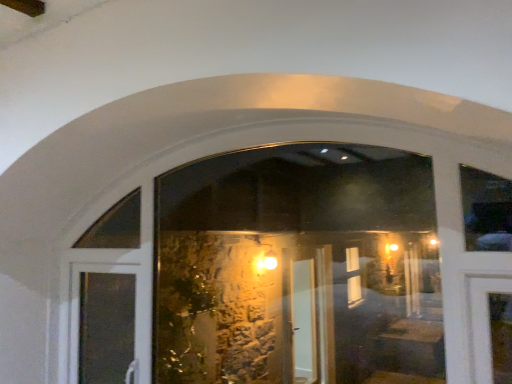
The image size is (512, 384). Find the location of `transparent glass door at center`. transparent glass door at center is located at coordinates (298, 268).

What is the approximate height of transparent glass door at center?

transparent glass door at center is 91.74 centimeters tall.

What do you see at coordinates (298, 268) in the screenshot? I see `transparent glass door at center` at bounding box center [298, 268].

Where is `matte glass door at lower left`? Image resolution: width=512 pixels, height=384 pixels. matte glass door at lower left is located at coordinates (104, 325).

The width and height of the screenshot is (512, 384). Describe the element at coordinates (104, 325) in the screenshot. I see `matte glass door at lower left` at that location.

I want to click on transparent glass door at center, so click(x=298, y=268).

Is matte glass door at lower left to the right of transparent glass door at center from the viewer's perspective?

Incorrect, matte glass door at lower left is not on the right side of transparent glass door at center.

Does matte glass door at lower left come behind transparent glass door at center?

Yes, it is behind transparent glass door at center.

Which is in front, point (117, 275) or point (411, 310)?

The point (117, 275) is more forward.

From the image's perspective, does matte glass door at lower left appear lower than transparent glass door at center?

Indeed, from the image's perspective, matte glass door at lower left is shown beneath transparent glass door at center.

From a real-world perspective, is matte glass door at lower left physically located above or below transparent glass door at center?

matte glass door at lower left is below transparent glass door at center.

Is matte glass door at lower left wider or thinner than transparent glass door at center?

In the image, matte glass door at lower left appears to be wider than transparent glass door at center.

Between matte glass door at lower left and transparent glass door at center, which one has more height?

transparent glass door at center is taller.

Is matte glass door at lower left bigger or smaller than transparent glass door at center?

matte glass door at lower left is smaller than transparent glass door at center.

Is transparent glass door at center inside matte glass door at lower left?

That's incorrect, transparent glass door at center is not inside matte glass door at lower left.

Is matte glass door at lower left touching transparent glass door at center?

matte glass door at lower left and transparent glass door at center are clearly separated.

Is matte glass door at lower left turned away from transparent glass door at center?

That's right, matte glass door at lower left is facing away from transparent glass door at center.

How many degrees apart are the facing directions of matte glass door at lower left and transparent glass door at center?

They differ by 0.00073 degrees in their facing directions.

Image resolution: width=512 pixels, height=384 pixels. I want to click on shop window above the matte glass door at lower left (from a real-world perspective), so click(298, 268).

Which object is positioned more to the left, transparent glass door at center or matte glass door at lower left?

matte glass door at lower left.

Consider the image. In the image, is transparent glass door at center positioned in front of or behind matte glass door at lower left?

transparent glass door at center is positioned closer to the viewer than matte glass door at lower left.

Which is nearer, (405, 219) or (101, 354)?

Positioned in front is point (101, 354).

From the image's perspective, is transparent glass door at center on matte glass door at lower left?

Indeed, from the image's perspective, transparent glass door at center is shown above matte glass door at lower left.

From a real-world perspective, is transparent glass door at center under matte glass door at lower left?

No, from a real-world perspective, transparent glass door at center is not below matte glass door at lower left.

Which object is wider, transparent glass door at center or matte glass door at lower left?

matte glass door at lower left is wider.

Considering the relative sizes of transparent glass door at center and matte glass door at lower left in the image provided, is transparent glass door at center taller than matte glass door at lower left?

Yes, transparent glass door at center is taller than matte glass door at lower left.

Considering the sizes of objects transparent glass door at center and matte glass door at lower left in the image provided, who is smaller, transparent glass door at center or matte glass door at lower left?

With smaller size is matte glass door at lower left.

Does transparent glass door at center contain matte glass door at lower left?

Indeed, matte glass door at lower left is located within transparent glass door at center.

Would you consider transparent glass door at center to be distant from matte glass door at lower left?

Yes, transparent glass door at center is far from matte glass door at lower left.

Is transparent glass door at center oriented towards matte glass door at lower left?

Yes, transparent glass door at center is turned towards matte glass door at lower left.

Where is `shop window on the right side of matte glass door at lower left`? This screenshot has height=384, width=512. shop window on the right side of matte glass door at lower left is located at coordinates (298, 268).

The width and height of the screenshot is (512, 384). In the image, there is a transparent glass door at center. In order to click on door below it (from a real-world perspective) in this screenshot , I will do `click(104, 325)`.

What are the coordinates of `shop window on the right of matte glass door at lower left` in the screenshot? It's located at (298, 268).